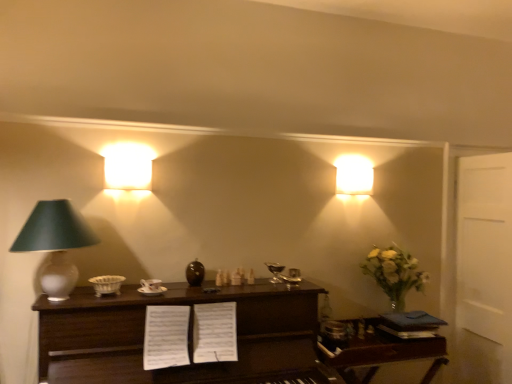
What is the approximate width of matte white lampshade at upper left, which ranks as the 2th lamp in right-to-left order?

5.17 inches.

Find the location of `wooden table at right, which is the 1th table in right-to-left order`. wooden table at right, which is the 1th table in right-to-left order is located at coordinates (379, 351).

I want to click on matte white lamp at left, which is the 1th lamp from front to back, so click(55, 243).

Measure the distance between point (367, 169) and camera.

The depth of point (367, 169) is 9.41 feet.

Based on the photo, measure the distance between point (140, 312) and camera.

A distance of 2.10 meters exists between point (140, 312) and camera.

The height and width of the screenshot is (384, 512). What do you see at coordinates (182, 366) in the screenshot?
I see `dark wood table at center, positioned as the second table in right-to-left order` at bounding box center [182, 366].

Locate an element on the screen. The width and height of the screenshot is (512, 384). matte white lampshade at upper left, the second lamp from the back is located at coordinates (128, 166).

Is wooden table at right, the 2th table viewed from the left, located within dark wood table at center, positioned as the second table in right-to-left order?

That's incorrect, wooden table at right, the 2th table viewed from the left, is not inside dark wood table at center, positioned as the second table in right-to-left order.

From a real-world perspective, who is located higher, dark wood table at center, positioned as the 1th table in left-to-right order, or wooden table at right, the 2th table viewed from the left?

dark wood table at center, positioned as the 1th table in left-to-right order.

Would you say dark wood table at center, positioned as the second table in right-to-left order, is to the left or to the right of wooden table at right, which is the 1th table in right-to-left order, in the picture?

From the image, it's evident that dark wood table at center, positioned as the second table in right-to-left order, is to the left of wooden table at right, which is the 1th table in right-to-left order.

Measure the distance between dark wood table at center, positioned as the second table in right-to-left order, and wooden table at right, the 2th table viewed from the left.

A distance of 22.65 inches exists between dark wood table at center, positioned as the second table in right-to-left order, and wooden table at right, the 2th table viewed from the left.

Where is `lamp on the right side of matte white lampshade at upper left, the 2th lamp from the left`? This screenshot has height=384, width=512. lamp on the right side of matte white lampshade at upper left, the 2th lamp from the left is located at coordinates (354, 175).

From the image's perspective, is matte white square light at upper right, which is counted as the first lamp, starting from the back, positioned above or below matte white lampshade at upper left, marked as the second lamp in a front-to-back arrangement?

Based on their image positions, matte white square light at upper right, which is counted as the first lamp, starting from the back, is located beneath matte white lampshade at upper left, marked as the second lamp in a front-to-back arrangement.

Between matte white square light at upper right, which is counted as the first lamp, starting from the back, and matte white lampshade at upper left, marked as the second lamp in a front-to-back arrangement, which one has larger width?

Wider between the two is matte white lampshade at upper left, marked as the second lamp in a front-to-back arrangement.

From the image's perspective, count 1st lamps upward from the matte white lamp at left, which ranks as the 1th lamp in left-to-right order, and point to it. Please provide its 2D coordinates.

[(354, 175)]

Is matte white lamp at left, placed as the 3th lamp when sorted from back to front, inside the boundaries of matte white square light at upper right, the 1th lamp positioned from the right, or outside?

matte white lamp at left, placed as the 3th lamp when sorted from back to front, exists outside the volume of matte white square light at upper right, the 1th lamp positioned from the right.

Which object is positioned more to the left, matte white lamp at left, the 3th lamp in the right-to-left sequence, or matte white square light at upper right, the 3th lamp positioned from the front?

Positioned to the left is matte white lamp at left, the 3th lamp in the right-to-left sequence.

Looking at this image, is matte white lamp at left, which ranks as the 1th lamp in left-to-right order, smaller than matte white square light at upper right, the 1th lamp positioned from the right?

No, matte white lamp at left, which ranks as the 1th lamp in left-to-right order, is not smaller than matte white square light at upper right, the 1th lamp positioned from the right.

From the image's perspective, who appears lower, wooden table at right, which is the 1th table in right-to-left order, or dark wood table at center, positioned as the second table in right-to-left order?

From the image's view, wooden table at right, which is the 1th table in right-to-left order, is below.

Does wooden table at right, the 2th table viewed from the left, have a lesser height compared to dark wood table at center, positioned as the second table in right-to-left order?

Yes.

Is dark wood table at center, positioned as the 1th table in left-to-right order, at the back of wooden table at right, which is the 1th table in right-to-left order?

No, dark wood table at center, positioned as the 1th table in left-to-right order, is not at the back of wooden table at right, which is the 1th table in right-to-left order.

Looking at this image, is wooden table at right, the 2th table viewed from the left, closer to the viewer compared to dark wood table at center, positioned as the second table in right-to-left order?

No, wooden table at right, the 2th table viewed from the left, is further to the viewer.

Is matte white lamp at left, placed as the 3th lamp when sorted from back to front, beside dark wood table at center, positioned as the second table in right-to-left order?

matte white lamp at left, placed as the 3th lamp when sorted from back to front, and dark wood table at center, positioned as the second table in right-to-left order, are clearly separated.

Measure the distance from matte white lamp at left, which is the 1th lamp from front to back, to dark wood table at center, positioned as the 1th table in left-to-right order.

A distance of 19.17 inches exists between matte white lamp at left, which is the 1th lamp from front to back, and dark wood table at center, positioned as the 1th table in left-to-right order.

What's the angular difference between matte white lamp at left, placed as the 3th lamp when sorted from back to front, and dark wood table at center, positioned as the 1th table in left-to-right order,'s facing directions?

They differ by 1.47 degrees in their facing directions.

This screenshot has width=512, height=384. I want to click on the 1st lamp above the dark wood table at center, positioned as the second table in right-to-left order (from the image's perspective), so click(x=55, y=243).

From the image's perspective, is matte white lamp at left, which is the 1th lamp from front to back, located above or below matte white lampshade at upper left, the second lamp from the back?

From the image's perspective, matte white lamp at left, which is the 1th lamp from front to back, appears below matte white lampshade at upper left, the second lamp from the back.

From a real-world perspective, is matte white lamp at left, the 3th lamp in the right-to-left sequence, positioned over matte white lampshade at upper left, the second lamp from the back, based on gravity?

No.

Is matte white lamp at left, the 3th lamp in the right-to-left sequence, inside or outside of matte white lampshade at upper left, the second lamp from the back?

matte white lamp at left, the 3th lamp in the right-to-left sequence, is not inside matte white lampshade at upper left, the second lamp from the back, it's outside.

From a real-world perspective, is matte white square light at upper right, placed as the 3th lamp when sorted from left to right, below wooden table at right, the 2th table viewed from the left?

Actually, matte white square light at upper right, placed as the 3th lamp when sorted from left to right, is physically above wooden table at right, the 2th table viewed from the left, in the real world.

From the image's perspective, which table is the 2nd one below the matte white square light at upper right, the 1th lamp positioned from the right? Please provide its 2D coordinates.

[(379, 351)]

From the image's perspective, which object appears higher, matte white square light at upper right, the 1th lamp positioned from the right, or wooden table at right, the 2th table viewed from the left?

matte white square light at upper right, the 1th lamp positioned from the right, is shown above in the image.

Considering the sizes of objects matte white square light at upper right, the 1th lamp positioned from the right, and wooden table at right, the 2th table viewed from the left, in the image provided, who is bigger, matte white square light at upper right, the 1th lamp positioned from the right, or wooden table at right, the 2th table viewed from the left,?

wooden table at right, the 2th table viewed from the left, is bigger.

Locate an element on the screen. This screenshot has height=384, width=512. table in front of the wooden table at right, the 2th table viewed from the left is located at coordinates (182, 366).

Identify the location of the 1st lamp positioned below the matte white lampshade at upper left, marked as the second lamp in a front-to-back arrangement (from the image's perspective). (354, 175).

When comparing their distances from matte white lamp at left, which ranks as the 1th lamp in left-to-right order, does dark wood table at center, positioned as the 1th table in left-to-right order, or matte white square light at upper right, which is counted as the first lamp, starting from the back, seem closer?

dark wood table at center, positioned as the 1th table in left-to-right order, lies closer to matte white lamp at left, which ranks as the 1th lamp in left-to-right order, than the other object.

From the image, which object appears to be nearer to matte white square light at upper right, which is counted as the first lamp, starting from the back, matte white lamp at left, placed as the 3th lamp when sorted from back to front, or wooden table at right, the 2th table viewed from the left?

Based on the image, wooden table at right, the 2th table viewed from the left, appears to be nearer to matte white square light at upper right, which is counted as the first lamp, starting from the back.

Which object lies further to the anchor point matte white square light at upper right, which is counted as the first lamp, starting from the back, matte white lampshade at upper left, the second lamp from the back, or wooden table at right, the 2th table viewed from the left?

The object further to matte white square light at upper right, which is counted as the first lamp, starting from the back, is matte white lampshade at upper left, the second lamp from the back.

Estimate the real-world distances between objects in this image. Which object is further from wooden table at right, the 2th table viewed from the left, matte white square light at upper right, which is counted as the first lamp, starting from the back, or matte white lampshade at upper left, which ranks as the 2th lamp in right-to-left order?

matte white lampshade at upper left, which ranks as the 2th lamp in right-to-left order, lies further to wooden table at right, the 2th table viewed from the left, than the other object.

From the image, which object appears to be nearer to wooden table at right, which is the 1th table in right-to-left order, dark wood table at center, positioned as the 1th table in left-to-right order, or matte white lampshade at upper left, which ranks as the 2th lamp in right-to-left order?

dark wood table at center, positioned as the 1th table in left-to-right order, lies closer to wooden table at right, which is the 1th table in right-to-left order, than the other object.

Which object lies nearer to the anchor point matte white square light at upper right, which is counted as the first lamp, starting from the back, wooden table at right, which is the 1th table in right-to-left order, or matte white lamp at left, placed as the 3th lamp when sorted from back to front?

Based on the image, wooden table at right, which is the 1th table in right-to-left order, appears to be nearer to matte white square light at upper right, which is counted as the first lamp, starting from the back.

Considering their positions, is matte white lamp at left, which is the 1th lamp from front to back, positioned closer to dark wood table at center, positioned as the 1th table in left-to-right order, than wooden table at right, the 2th table viewed from the left?

Based on the image, matte white lamp at left, which is the 1th lamp from front to back, appears to be nearer to dark wood table at center, positioned as the 1th table in left-to-right order.

Which object lies further to the anchor point matte white lampshade at upper left, the second lamp from the back, matte white lamp at left, placed as the 3th lamp when sorted from back to front, or wooden table at right, the 2th table viewed from the left?

wooden table at right, the 2th table viewed from the left, is positioned further to the anchor matte white lampshade at upper left, the second lamp from the back.

Where is `lamp between matte white lamp at left, which is the 1th lamp from front to back, and matte white square light at upper right, placed as the 3th lamp when sorted from left to right, from left to right`? Image resolution: width=512 pixels, height=384 pixels. lamp between matte white lamp at left, which is the 1th lamp from front to back, and matte white square light at upper right, placed as the 3th lamp when sorted from left to right, from left to right is located at coordinates (128, 166).

The width and height of the screenshot is (512, 384). I want to click on table between matte white lampshade at upper left, which ranks as the 2th lamp in right-to-left order, and wooden table at right, which is the 1th table in right-to-left order, in the horizontal direction, so click(x=182, y=366).

Identify the location of lamp situated between matte white lampshade at upper left, which ranks as the 2th lamp in right-to-left order, and wooden table at right, which is the 1th table in right-to-left order, from left to right. The height and width of the screenshot is (384, 512). (354, 175).

Find the location of a particular element. table between matte white lampshade at upper left, the second lamp from the back, and matte white square light at upper right, the 1th lamp positioned from the right is located at coordinates (182, 366).